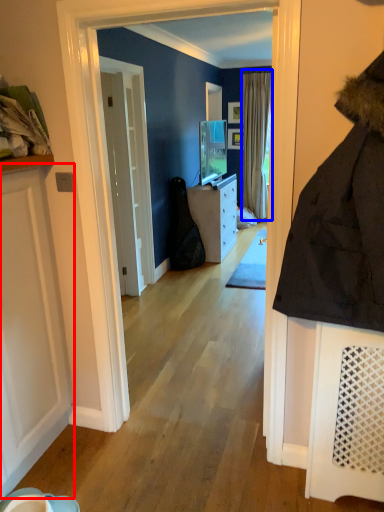
Question: Which object appears closest to the camera in this image, door (highlighted by a red box) or curtain (highlighted by a blue box)?

Choices:
 (A) door
 (B) curtain

Answer: (A)